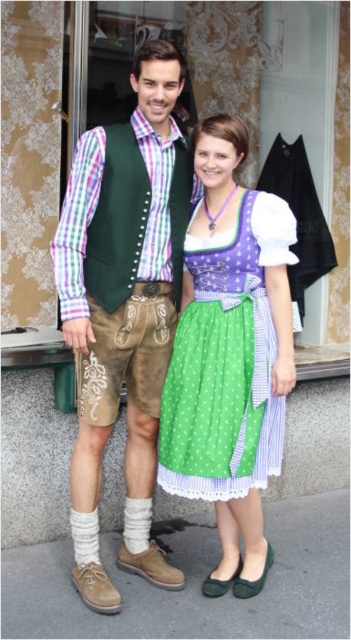
Is leather vest at center positioned in front of matte black apron at center?

Yes, it is in front of matte black apron at center.

Does leather vest at center have a lesser width compared to matte black apron at center?

No, leather vest at center is not thinner than matte black apron at center.

The image size is (351, 640). What do you see at coordinates (123, 307) in the screenshot? I see `leather vest at center` at bounding box center [123, 307].

Image resolution: width=351 pixels, height=640 pixels. Identify the location of leather vest at center. (123, 307).

From the picture: Does leather vest at center lie in front of green polka dot fabric dress at center?

Yes, leather vest at center is in front of green polka dot fabric dress at center.

Does point (82, 273) come behind point (183, 378)?

No, (82, 273) is in front of (183, 378).

Locate an element on the screen. This screenshot has height=640, width=351. leather vest at center is located at coordinates (123, 307).

Is green polka dot fabric dress at center thinner than matte black apron at center?

No, green polka dot fabric dress at center is not thinner than matte black apron at center.

Can you confirm if green polka dot fabric dress at center is positioned above matte black apron at center?

No, green polka dot fabric dress at center is not above matte black apron at center.

Image resolution: width=351 pixels, height=640 pixels. What do you see at coordinates (227, 362) in the screenshot?
I see `green polka dot fabric dress at center` at bounding box center [227, 362].

Locate an element on the screen. green polka dot fabric dress at center is located at coordinates (227, 362).